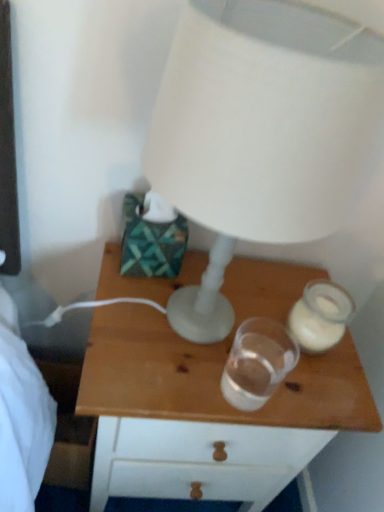
At what (x,y) coordinates should I click in order to perform the action: click on vacant space in between translucent glass candle holder at right, the first candle holder in the right-to-left sequence, and transparent glass at center, the first candle holder positioned from the left. Please return your answer as a coordinate pair (x, y). The height and width of the screenshot is (512, 384). Looking at the image, I should click on (267, 359).